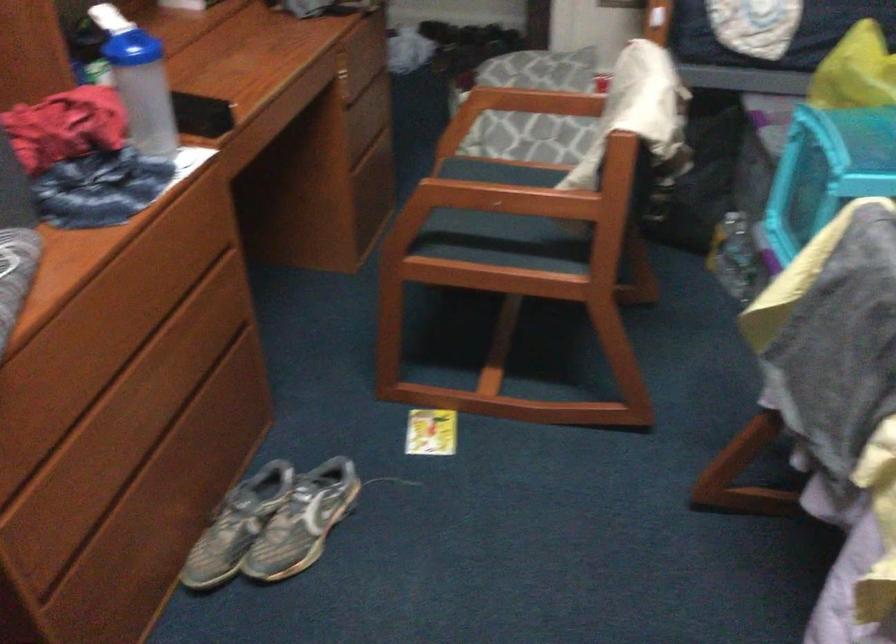
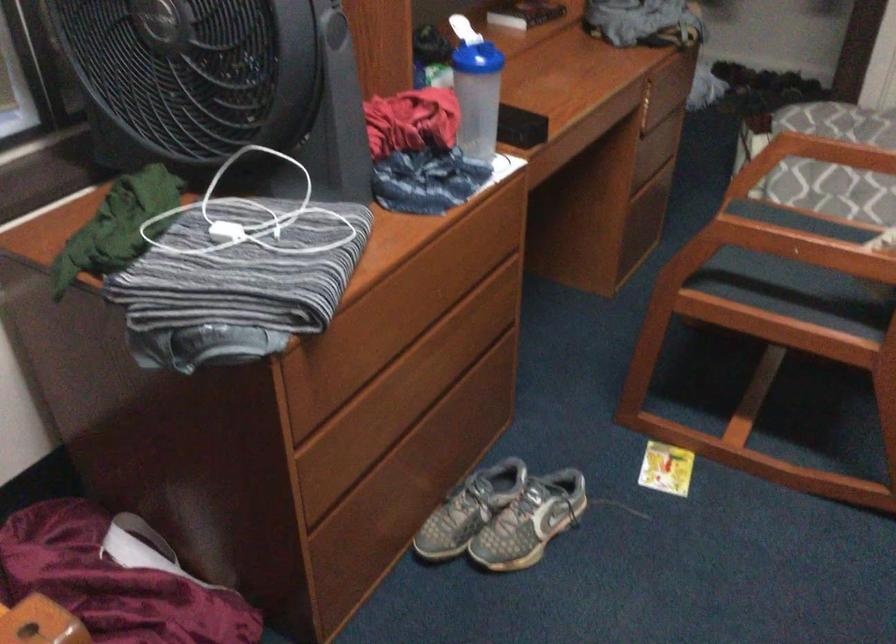
In the second image, find the point that corresponds to the point at 99,368 in the first image.

(393, 339)